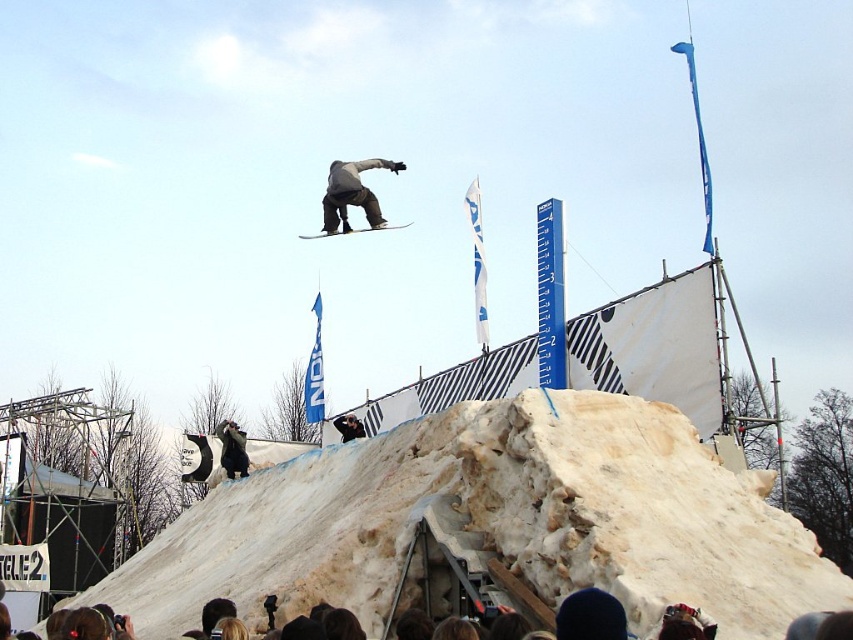
Does white fluffy mound at lower center appear on the right side of matte black snowboard at center?

Incorrect, white fluffy mound at lower center is not on the right side of matte black snowboard at center.

At what (x,y) coordinates should I click in order to perform the action: click on white fluffy mound at lower center. Please return your answer as a coordinate pair (x, y). Looking at the image, I should click on (494, 522).

Where is `white fluffy mound at lower center`? Image resolution: width=853 pixels, height=640 pixels. white fluffy mound at lower center is located at coordinates (494, 522).

Does white fluffy mound at lower center have a greater height compared to gray matte snowboarder at center?

Correct, white fluffy mound at lower center is much taller as gray matte snowboarder at center.

Is point (395, 470) more distant than point (387, 163)?

No.

Where is `white fluffy mound at lower center`? white fluffy mound at lower center is located at coordinates [x=494, y=522].

Between point (337, 227) and point (334, 234), which one is positioned behind?

The point (337, 227) is more distant.

You are a GUI agent. You are given a task and a screenshot of the screen. Output one action in this format:
    pyautogui.click(x=<x>, y=<y>)
    Task: Click on the gray matte snowboarder at center
    The image size is (853, 640).
    Given the screenshot: What is the action you would take?
    pyautogui.click(x=352, y=195)